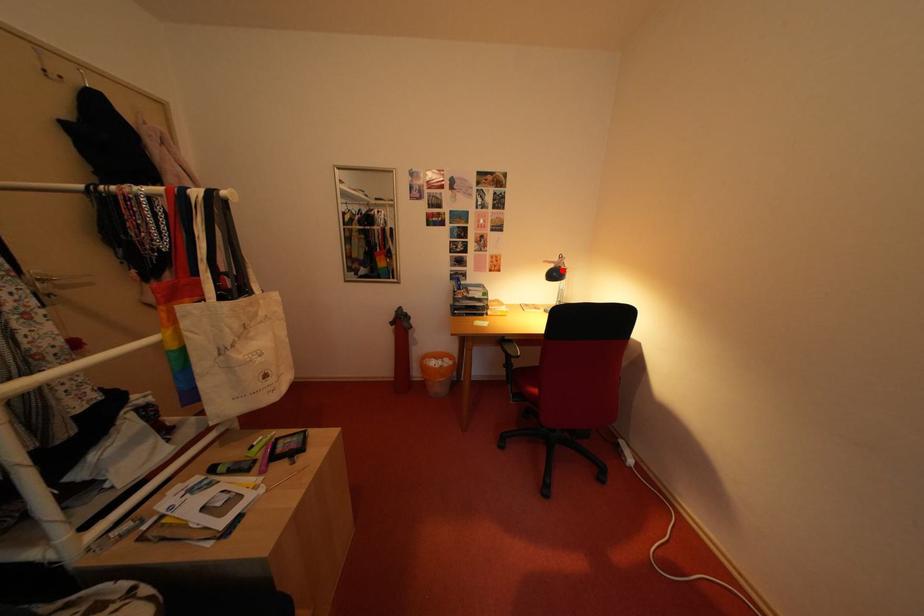
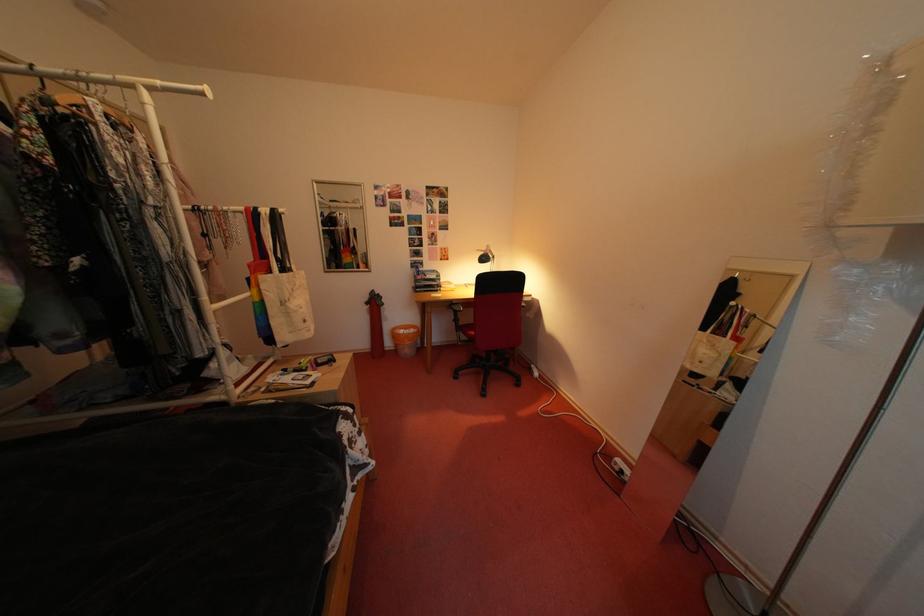
Question: I am providing you with two images of the same scene from different viewpoints. Given a red point in image1, look at the same physical point in image2. Is it:

Choices:
 (A) Closer to the viewpoint
 (B) Farther from the viewpoint

Answer: (A)